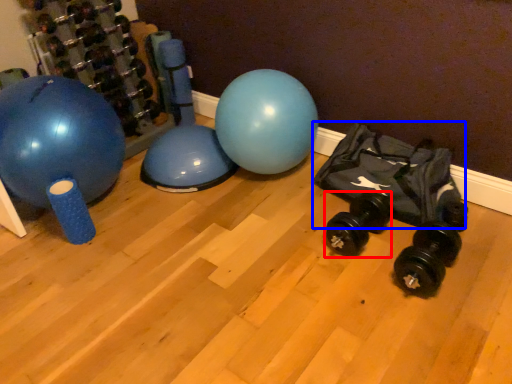
Question: Among these objects, which one is farthest to the camera, dumbbell (highlighted by a red box) or bean bag chair (highlighted by a blue box)?

Choices:
 (A) dumbbell
 (B) bean bag chair

Answer: (A)